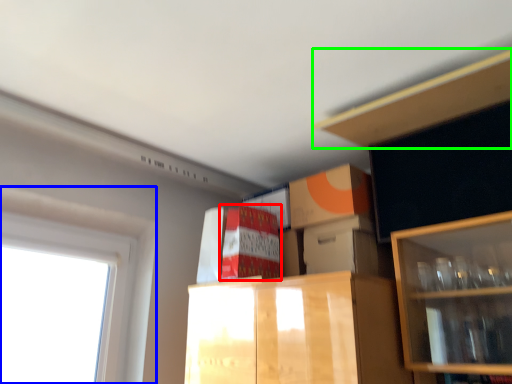
Question: Estimate the real-world distances between objects in this image. Which object is closer to cabinetry (highlighted by a red box), window (highlighted by a blue box) or cabinet (highlighted by a green box)?

Choices:
 (A) window
 (B) cabinet

Answer: (A)